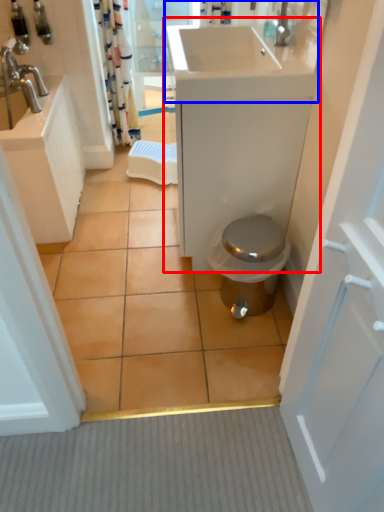
Question: Among these objects, which one is nearest to the camera, bathroom cabinet (highlighted by a red box) or sink (highlighted by a blue box)?

Choices:
 (A) bathroom cabinet
 (B) sink

Answer: (B)